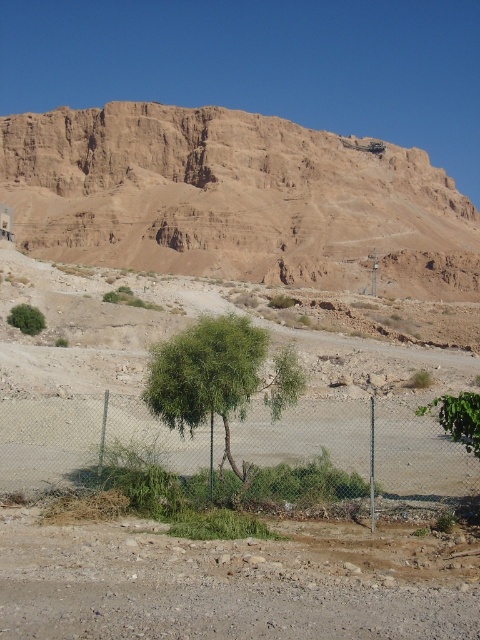
Is green leafy bush at center to the left of green leafy bush at lower left from the viewer's perspective?

In fact, green leafy bush at center is to the right of green leafy bush at lower left.

Between point (474, 433) and point (19, 324), which one is positioned behind?

Point (19, 324)

Does point (437, 420) come behind point (12, 317)?

No, (437, 420) is in front of (12, 317).

Locate an element on the screen. The image size is (480, 640). green leafy bush at center is located at coordinates (458, 417).

Measure the distance from brown rocky mountain at upper center to green leafy bush at center.

They are 164.05 meters apart.

Between brown rocky mountain at upper center and green leafy bush at center, which one has less height?

green leafy bush at center is shorter.

Locate an element on the screen. The image size is (480, 640). brown rocky mountain at upper center is located at coordinates (236, 198).

Where is `brown rocky mountain at upper center`? brown rocky mountain at upper center is located at coordinates (236, 198).

The image size is (480, 640). What do you see at coordinates (236, 198) in the screenshot?
I see `brown rocky mountain at upper center` at bounding box center [236, 198].

Does brown rocky mountain at upper center appear on the left side of metallic chain-link fence at center?

Incorrect, brown rocky mountain at upper center is not on the left side of metallic chain-link fence at center.

Is point (345, 228) positioned after point (437, 408)?

Yes, point (345, 228) is farther from viewer.

The width and height of the screenshot is (480, 640). What are the coordinates of `brown rocky mountain at upper center` in the screenshot? It's located at (236, 198).